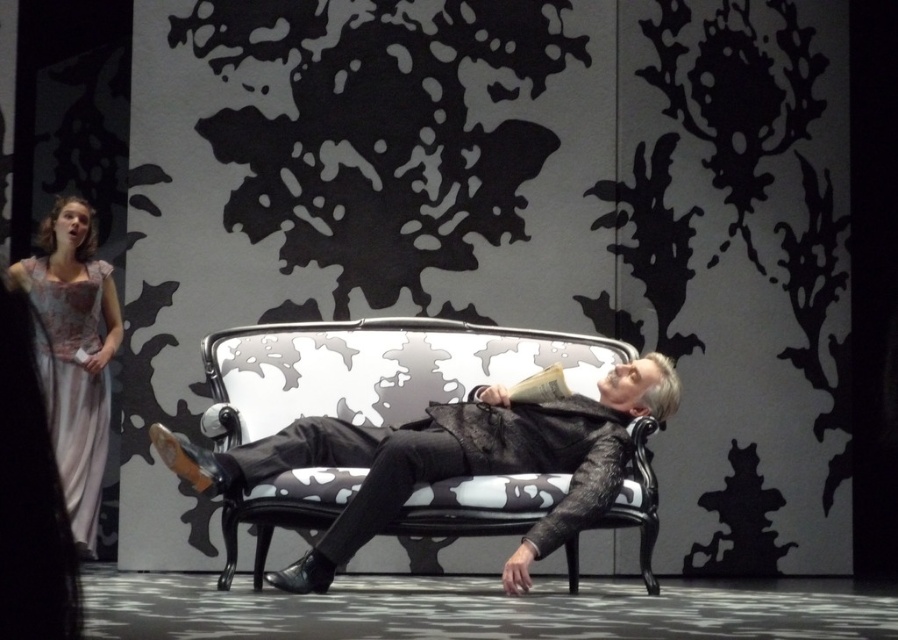
You are standing at the entrance of the theater and want to sit on the black leather couch at center. According to the stage layout, what are the coordinates where you should head to?

The black leather couch at center is located at point (376, 369), so you should head to those coordinates to reach it.

You are a stagehand preparing for a play. The director wants to ensure there is enough space between the black leather couch at center and the silky satin gown at left for a performer to move freely. The performer requires a minimum of 4 feet of space. Can the current setup accommodate this?

The black leather couch at center is 4.23 feet from the silky satin gown at left, which exceeds the required 4 feet of space. The current setup can accommodate the performer.